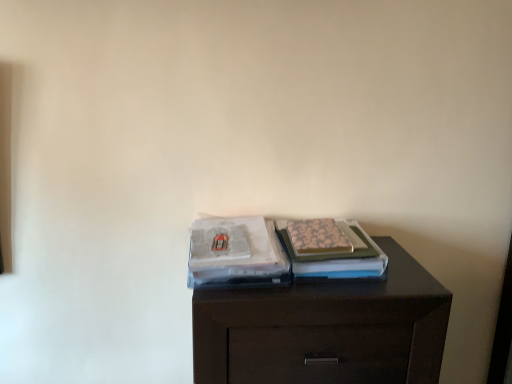
Where is `vacant point above matte plastic magazine at center, which is the first magazine from left to right (from a real-world perspective)`? The width and height of the screenshot is (512, 384). vacant point above matte plastic magazine at center, which is the first magazine from left to right (from a real-world perspective) is located at coordinates (239, 240).